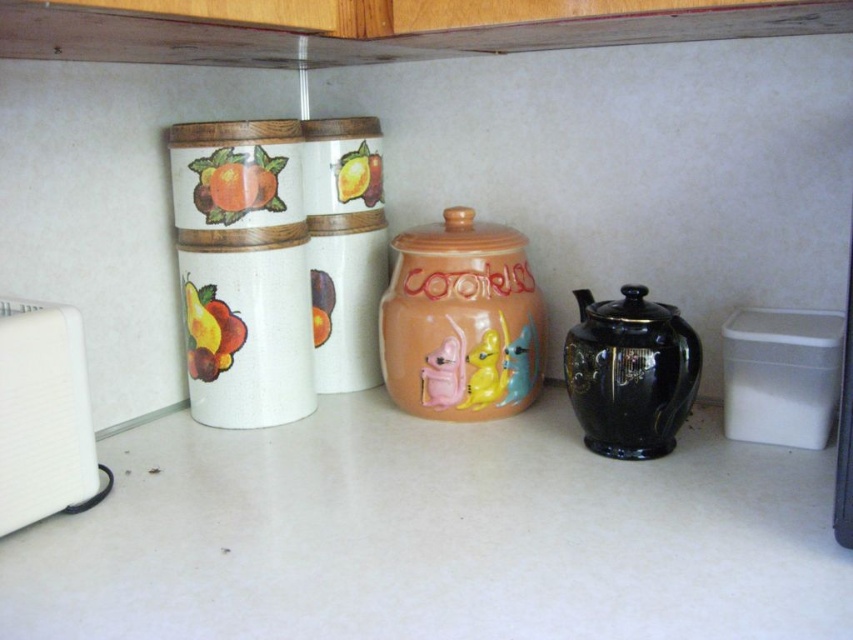
Question: Considering the real-world distances, which object is farthest from the white plastic toaster at left?

Choices:
 (A) white matte counter top at center
 (B) black glossy teapot at right

Answer: (B)

Question: Can you confirm if white matte counter top at center is positioned to the right of white plastic toaster at left?

Choices:
 (A) yes
 (B) no

Answer: (A)

Question: Does white plastic toaster at left have a lesser width compared to black glossy teapot at right?

Choices:
 (A) no
 (B) yes

Answer: (B)

Question: Can you confirm if white plastic toaster at left is thinner than black glossy teapot at right?

Choices:
 (A) yes
 (B) no

Answer: (A)

Question: Estimate the real-world distances between objects in this image. Which object is farther from the white matte counter top at center?

Choices:
 (A) black glossy teapot at right
 (B) white plastic toaster at left

Answer: (B)

Question: Which of the following is the farthest from the observer?

Choices:
 (A) black glossy teapot at right
 (B) white matte counter top at center
 (C) white plastic toaster at left

Answer: (A)